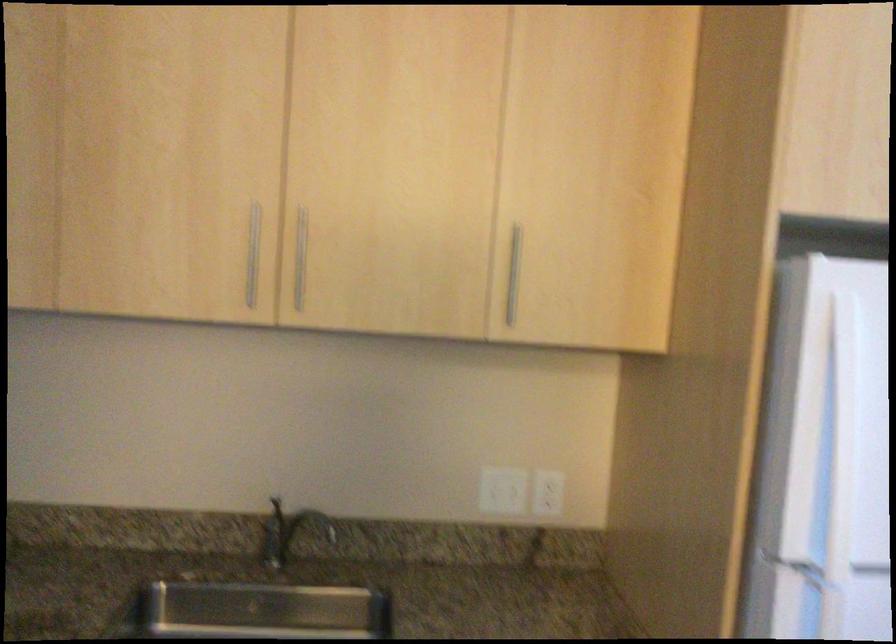
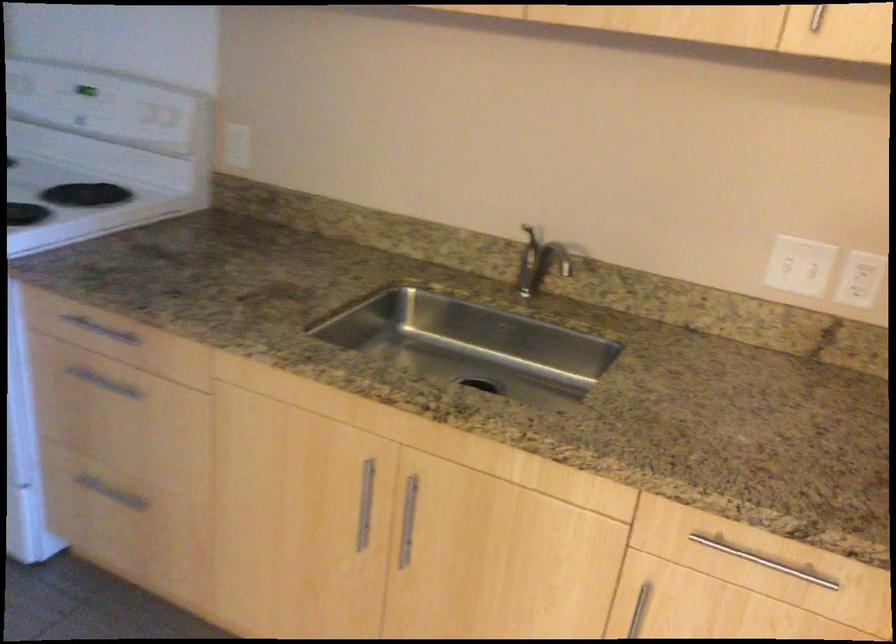
Find the pixel in the second image that matches point 506,489 in the first image.

(798, 266)